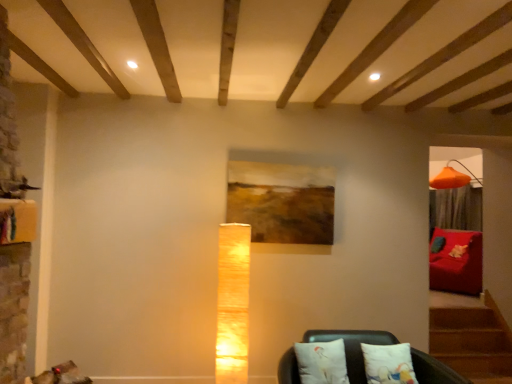
Question: Can you confirm if wooden painting at center is thinner than matte textured lamp at center?

Choices:
 (A) no
 (B) yes

Answer: (B)

Question: Is wooden painting at center completely or partially outside of matte textured lamp at center?

Choices:
 (A) no
 (B) yes

Answer: (B)

Question: Is wooden painting at center shorter than matte textured lamp at center?

Choices:
 (A) yes
 (B) no

Answer: (A)

Question: Considering the relative sizes of wooden painting at center and matte textured lamp at center in the image provided, is wooden painting at center wider than matte textured lamp at center?

Choices:
 (A) no
 (B) yes

Answer: (A)

Question: Could matte textured lamp at center be considered to be inside wooden painting at center?

Choices:
 (A) yes
 (B) no

Answer: (B)

Question: Is wooden painting at center not close to matte textured lamp at center?

Choices:
 (A) yes
 (B) no

Answer: (B)

Question: Is white fabric cushions at lower center, marked as the first furniture in a front-to-back arrangement, wider than velvet red sofa at right, which ranks as the first furniture in back-to-front order?

Choices:
 (A) no
 (B) yes

Answer: (A)

Question: Considering the relative sizes of white fabric cushions at lower center, which is the first furniture in left-to-right order, and velvet red sofa at right, the second furniture in the front-to-back sequence, in the image provided, is white fabric cushions at lower center, which is the first furniture in left-to-right order, thinner than velvet red sofa at right, the second furniture in the front-to-back sequence,?

Choices:
 (A) no
 (B) yes

Answer: (B)

Question: From the image's perspective, is white fabric cushions at lower center, marked as the first furniture in a front-to-back arrangement, under velvet red sofa at right, marked as the 2th furniture in a left-to-right arrangement?

Choices:
 (A) yes
 (B) no

Answer: (A)

Question: Can you confirm if white fabric cushions at lower center, which is the first furniture in left-to-right order, is positioned to the left of velvet red sofa at right, which ranks as the first furniture in back-to-front order?

Choices:
 (A) yes
 (B) no

Answer: (A)

Question: Does white fabric cushions at lower center, marked as the first furniture in a front-to-back arrangement, have a lesser height compared to velvet red sofa at right, marked as the 2th furniture in a left-to-right arrangement?

Choices:
 (A) yes
 (B) no

Answer: (A)

Question: Is velvet red sofa at right, which is counted as the first furniture, starting from the right, at the back of white fabric cushions at lower center, which is the first furniture in left-to-right order?

Choices:
 (A) yes
 (B) no

Answer: (B)

Question: Is white fabric cushions at lower center, marked as the first furniture in a front-to-back arrangement, taller than wooden painting at center?

Choices:
 (A) no
 (B) yes

Answer: (A)